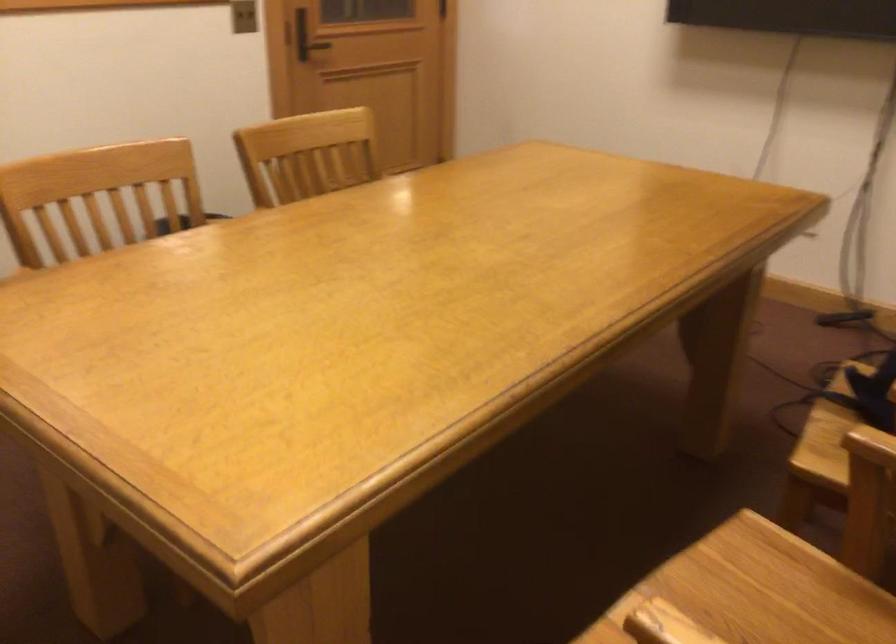
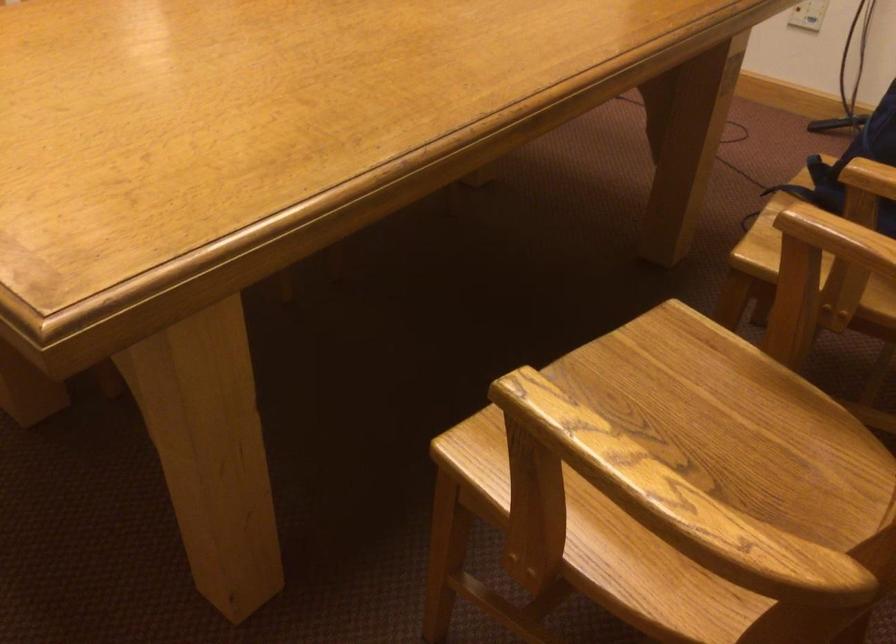
Question: Based on the continuous images, in which direction is the camera rotating? Reply with the corresponding letter.

Choices:
 (A) Left
 (B) Right
 (C) Up
 (D) Down

Answer: (D)